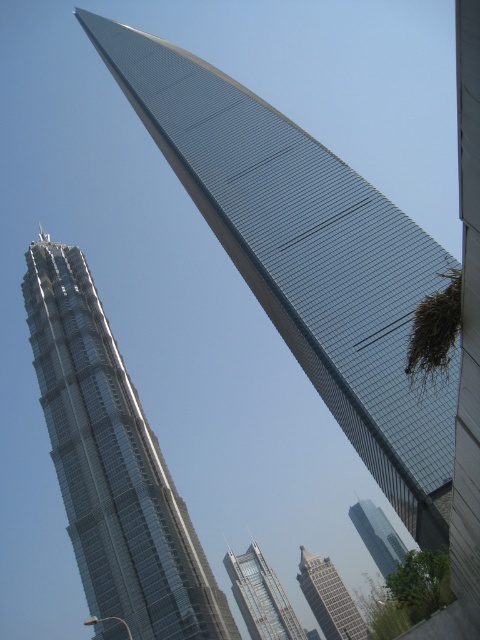
Question: Can you confirm if shiny glass skyscraper at upper right is wider than green glass skyscraper at center?

Choices:
 (A) no
 (B) yes

Answer: (B)

Question: Considering the relative positions of clear glass skyscraper at center and gray glass building at center in the image provided, where is clear glass skyscraper at center located with respect to gray glass building at center?

Choices:
 (A) right
 (B) left

Answer: (B)

Question: Estimate the real-world distances between objects in this image. Which object is farther from the green glass skyscraper at center?

Choices:
 (A) shiny silver skyscraper at left
 (B) clear glass skyscraper at center
 (C) shiny glass skyscraper at upper right

Answer: (C)

Question: Can you confirm if shiny glass skyscraper at upper right is positioned above green glass skyscraper at center?

Choices:
 (A) no
 (B) yes

Answer: (B)

Question: Which point is closer to the camera?

Choices:
 (A) (93, 396)
 (B) (372, 538)

Answer: (A)

Question: Which of the following is the farthest from the observer?

Choices:
 (A) shiny glass skyscraper at upper right
 (B) gray glass building at center

Answer: (B)